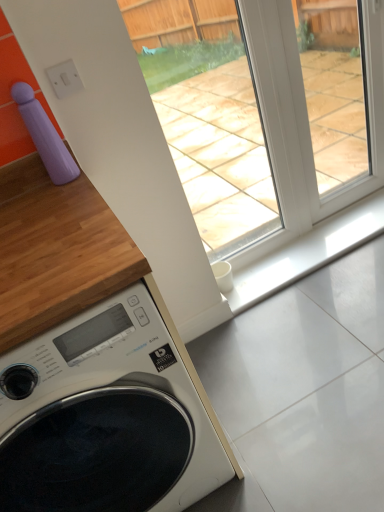
This screenshot has width=384, height=512. What do you see at coordinates (108, 415) in the screenshot?
I see `white glossy washing machine at lower left` at bounding box center [108, 415].

What is the approximate height of white glossy washing machine at lower left?

white glossy washing machine at lower left is 38.37 inches tall.

Locate an element on the screen. The image size is (384, 512). white glossy washing machine at lower left is located at coordinates (108, 415).

The image size is (384, 512). I want to click on white glossy washing machine at lower left, so click(108, 415).